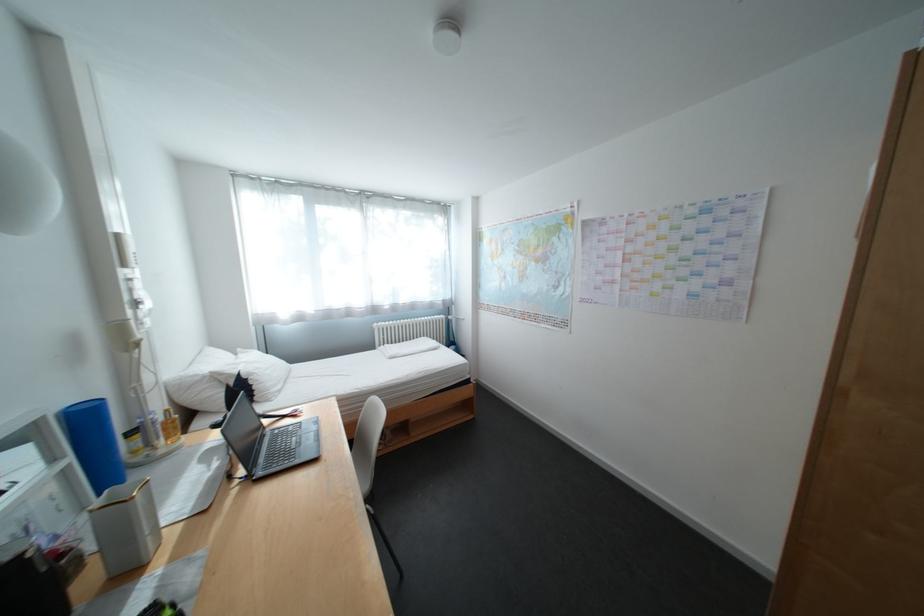
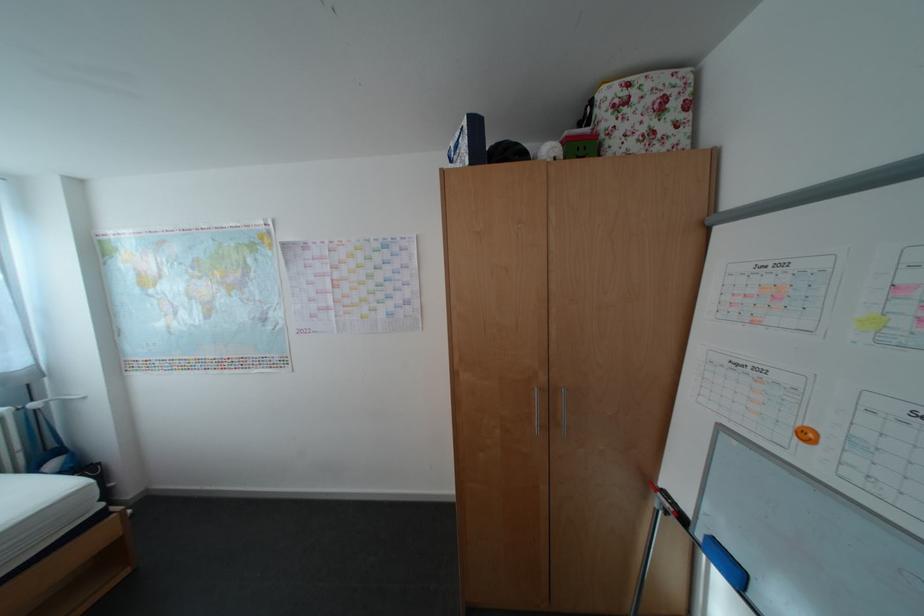
Question: The camera is either moving clockwise (left) or counter-clockwise (right) around the object. The first image is from the beginning of the video and the second image is from the end. Is the camera moving left or right when shooting the video?

Choices:
 (A) Left
 (B) Right

Answer: (A)